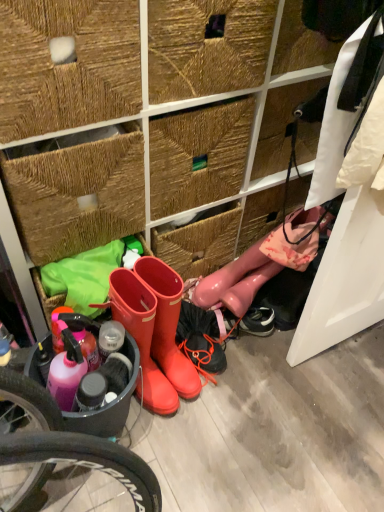
Find the location of a particular element. glossy pink boots at lower right, which is counted as the third footwear, starting from the left is located at coordinates (262, 263).

The image size is (384, 512). What are the coordinates of `rubber boots at center, which appears as the second footwear when viewed from the right` in the screenshot? It's located at (168, 325).

Does rubber boots at center, which is the 2th footwear from left to right, turn towards rubber boots at center, the 3th footwear positioned from the right?

No, rubber boots at center, which is the 2th footwear from left to right, is not aimed at rubber boots at center, the 3th footwear positioned from the right.

Is there a large distance between rubber boots at center, which appears as the second footwear when viewed from the right, and rubber boots at center, the 3th footwear positioned from the right?

No.

Is rubber boots at center, which is the 2th footwear from left to right, shorter than rubber boots at center, the 1th footwear viewed from the left?

Incorrect, the height of rubber boots at center, which is the 2th footwear from left to right, does not fall short of that of rubber boots at center, the 1th footwear viewed from the left.

From the image's perspective, between rubber boots at center, which appears as the second footwear when viewed from the right, and rubber boots at center, the 1th footwear viewed from the left, which one is located above?

From the image's view, rubber boots at center, which appears as the second footwear when viewed from the right, is above.

Between glossy pink boots at lower right, marked as the first footwear in a right-to-left arrangement, and rubber boots at center, the 1th footwear viewed from the left, which one has smaller width?

glossy pink boots at lower right, marked as the first footwear in a right-to-left arrangement.

Is glossy pink boots at lower right, which is counted as the third footwear, starting from the left, facing away from rubber boots at center, the 3th footwear positioned from the right?

No, glossy pink boots at lower right, which is counted as the third footwear, starting from the left, is not facing the opposite direction of rubber boots at center, the 3th footwear positioned from the right.

Is there a large distance between glossy pink boots at lower right, which is counted as the third footwear, starting from the left, and rubber boots at center, the 3th footwear positioned from the right?

No, there isn't a large distance between glossy pink boots at lower right, which is counted as the third footwear, starting from the left, and rubber boots at center, the 3th footwear positioned from the right.

Measure the distance between glossy pink boots at lower right, which is counted as the third footwear, starting from the left, and rubber boots at center, the 1th footwear viewed from the left.

14.14 inches.

Considering the positions of objects rubber boots at center, which is the 2th footwear from left to right, and glossy pink boots at lower right, which is counted as the third footwear, starting from the left, in the image provided, who is behind, rubber boots at center, which is the 2th footwear from left to right, or glossy pink boots at lower right, which is counted as the third footwear, starting from the left,?

glossy pink boots at lower right, which is counted as the third footwear, starting from the left.

Which is more to the right, rubber boots at center, which is the 2th footwear from left to right, or glossy pink boots at lower right, which is counted as the third footwear, starting from the left?

glossy pink boots at lower right, which is counted as the third footwear, starting from the left.

How distant is rubber boots at center, which appears as the second footwear when viewed from the right, from glossy pink boots at lower right, marked as the first footwear in a right-to-left arrangement?

They are 10.65 inches apart.

From the image's perspective, which object appears higher, rubber boots at center, which appears as the second footwear when viewed from the right, or glossy pink boots at lower right, which is counted as the third footwear, starting from the left?

glossy pink boots at lower right, which is counted as the third footwear, starting from the left, appears higher in the image.

Is rubber boots at center, the 1th footwear viewed from the left, at the right side of glossy pink boots at lower right, marked as the first footwear in a right-to-left arrangement?

In fact, rubber boots at center, the 1th footwear viewed from the left, is to the left of glossy pink boots at lower right, marked as the first footwear in a right-to-left arrangement.

Is rubber boots at center, the 3th footwear positioned from the right, beside glossy pink boots at lower right, which is counted as the third footwear, starting from the left?

No, rubber boots at center, the 3th footwear positioned from the right, is not touching glossy pink boots at lower right, which is counted as the third footwear, starting from the left.

Is point (127, 298) farther from camera compared to point (259, 242)?

No.

Considering the relative sizes of rubber boots at center, the 3th footwear positioned from the right, and glossy pink boots at lower right, marked as the first footwear in a right-to-left arrangement, in the image provided, is rubber boots at center, the 3th footwear positioned from the right, smaller than glossy pink boots at lower right, marked as the first footwear in a right-to-left arrangement,?

No, rubber boots at center, the 3th footwear positioned from the right, is not smaller than glossy pink boots at lower right, marked as the first footwear in a right-to-left arrangement.

Measure the distance between glossy pink boots at lower right, which is counted as the third footwear, starting from the left, and rubber boots at center, which is the 2th footwear from left to right.

glossy pink boots at lower right, which is counted as the third footwear, starting from the left, and rubber boots at center, which is the 2th footwear from left to right, are 10.65 inches apart from each other.

Which of these two, glossy pink boots at lower right, which is counted as the third footwear, starting from the left, or rubber boots at center, which appears as the second footwear when viewed from the right, stands taller?

With more height is rubber boots at center, which appears as the second footwear when viewed from the right.

Consider the image. Which object is wider, glossy pink boots at lower right, marked as the first footwear in a right-to-left arrangement, or rubber boots at center, which is the 2th footwear from left to right?

With larger width is rubber boots at center, which is the 2th footwear from left to right.

Based on the photo, from the image's perspective, which object appears higher, glossy pink boots at lower right, marked as the first footwear in a right-to-left arrangement, or rubber boots at center, which appears as the second footwear when viewed from the right?

glossy pink boots at lower right, marked as the first footwear in a right-to-left arrangement.

Is the surface of rubber boots at center, the 3th footwear positioned from the right, in direct contact with rubber boots at center, which is the 2th footwear from left to right?

Yes.

Which point is more distant from viewer, (118, 271) or (165, 278)?

The point (165, 278) is farther.

Is rubber boots at center, the 3th footwear positioned from the right, positioned with its back to rubber boots at center, which appears as the second footwear when viewed from the right?

rubber boots at center, the 3th footwear positioned from the right, does not have its back to rubber boots at center, which appears as the second footwear when viewed from the right.

Which object is positioned more to the right, rubber boots at center, the 3th footwear positioned from the right, or rubber boots at center, which is the 2th footwear from left to right?

rubber boots at center, which is the 2th footwear from left to right.

Locate an element on the screen. The width and height of the screenshot is (384, 512). the 1st footwear to the right when counting from the rubber boots at center, the 1th footwear viewed from the left is located at coordinates (168, 325).

Image resolution: width=384 pixels, height=512 pixels. What are the coordinates of `the 2nd footwear below when counting from the glossy pink boots at lower right, marked as the first footwear in a right-to-left arrangement (from the image's perspective)` in the screenshot? It's located at (141, 337).

Based on their spatial positions, is glossy pink boots at lower right, which is counted as the third footwear, starting from the left, or rubber boots at center, which is the 2th footwear from left to right, further from rubber boots at center, the 3th footwear positioned from the right?

Based on the image, glossy pink boots at lower right, which is counted as the third footwear, starting from the left, appears to be further to rubber boots at center, the 3th footwear positioned from the right.

Which object lies nearer to the anchor point glossy pink boots at lower right, marked as the first footwear in a right-to-left arrangement, rubber boots at center, the 3th footwear positioned from the right, or rubber boots at center, which appears as the second footwear when viewed from the right?

rubber boots at center, which appears as the second footwear when viewed from the right, lies closer to glossy pink boots at lower right, marked as the first footwear in a right-to-left arrangement, than the other object.

Estimate the real-world distances between objects in this image. Which object is closer to glossy pink boots at lower right, which is counted as the third footwear, starting from the left, rubber boots at center, which is the 2th footwear from left to right, or rubber boots at center, the 1th footwear viewed from the left?

The object closer to glossy pink boots at lower right, which is counted as the third footwear, starting from the left, is rubber boots at center, which is the 2th footwear from left to right.

Based on their spatial positions, is glossy pink boots at lower right, marked as the first footwear in a right-to-left arrangement, or rubber boots at center, the 3th footwear positioned from the right, closer to rubber boots at center, which appears as the second footwear when viewed from the right?

rubber boots at center, the 3th footwear positioned from the right, lies closer to rubber boots at center, which appears as the second footwear when viewed from the right, than the other object.

Looking at the image, which one is located closer to rubber boots at center, the 3th footwear positioned from the right, rubber boots at center, which is the 2th footwear from left to right, or glossy pink boots at lower right, marked as the first footwear in a right-to-left arrangement?

rubber boots at center, which is the 2th footwear from left to right, is positioned closer to the anchor rubber boots at center, the 3th footwear positioned from the right.

Which object lies further to the anchor point rubber boots at center, which is the 2th footwear from left to right, rubber boots at center, the 1th footwear viewed from the left, or glossy pink boots at lower right, which is counted as the third footwear, starting from the left?

Based on the image, glossy pink boots at lower right, which is counted as the third footwear, starting from the left, appears to be further to rubber boots at center, which is the 2th footwear from left to right.

This screenshot has height=512, width=384. I want to click on footwear between rubber boots at center, the 3th footwear positioned from the right, and glossy pink boots at lower right, which is counted as the third footwear, starting from the left, in the horizontal direction, so click(x=168, y=325).